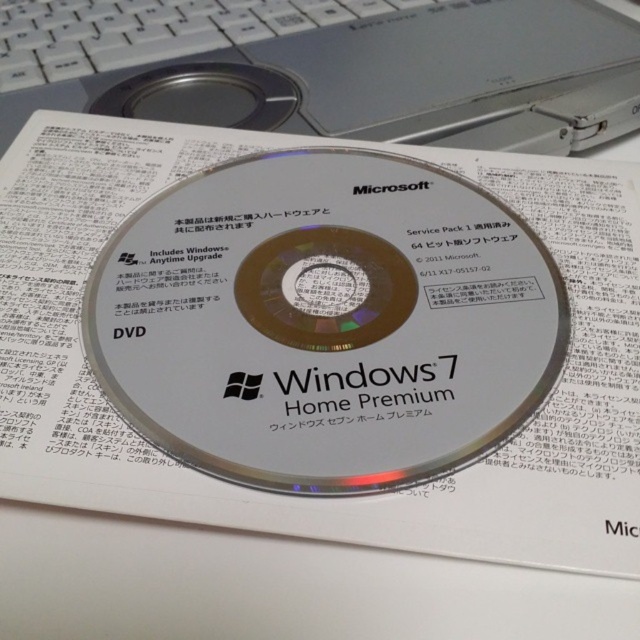
Question: Is transparent plastic dvd at center positioned in front of silver metallic laptop at center?

Choices:
 (A) yes
 (B) no

Answer: (A)

Question: Can you confirm if transparent plastic dvd at center is wider than silver metallic laptop at center?

Choices:
 (A) no
 (B) yes

Answer: (A)

Question: Which point is closer to the camera?

Choices:
 (A) (234, 284)
 (B) (413, 100)

Answer: (A)

Question: Is transparent plastic dvd at center bigger than silver metallic laptop at center?

Choices:
 (A) yes
 (B) no

Answer: (A)

Question: Which of the following is the farthest from the observer?

Choices:
 (A) silver metallic laptop at center
 (B) transparent plastic dvd at center

Answer: (A)